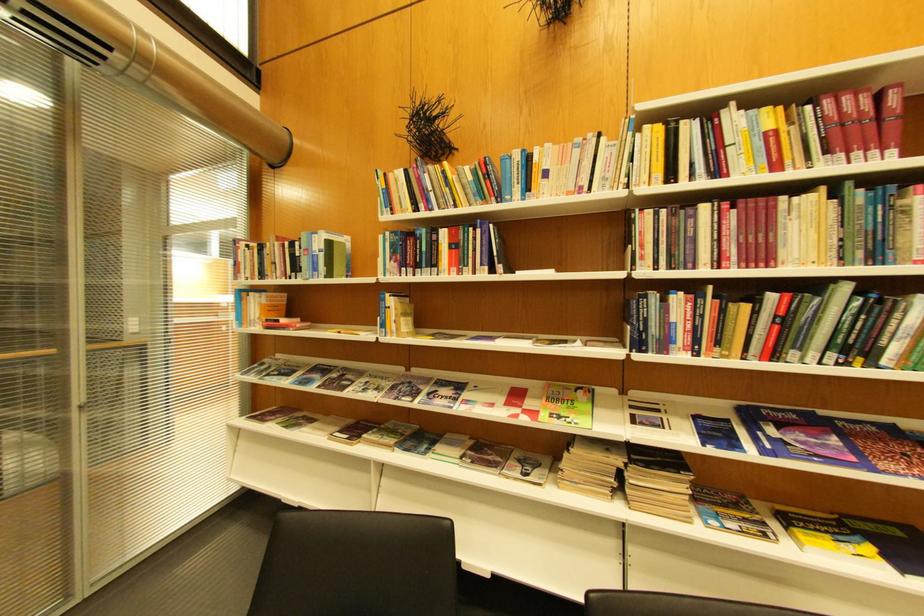
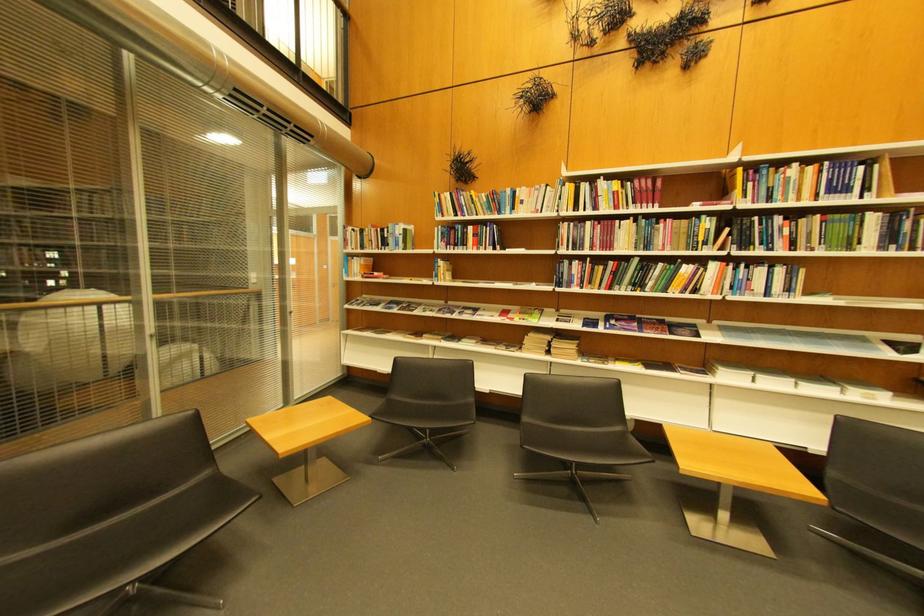
In the second image, find the point that corresponds to point (839, 103) in the first image.

(648, 183)